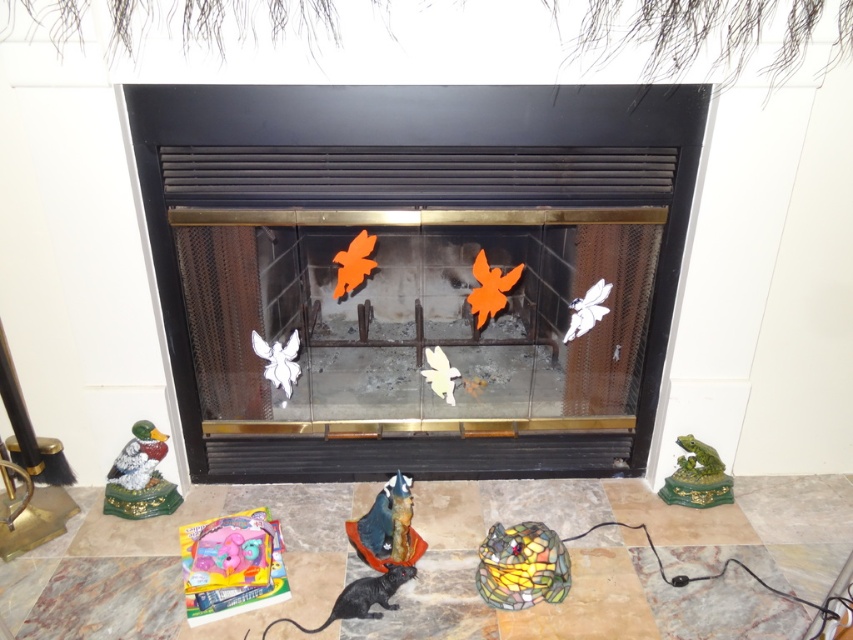
Is shiny metallic cat at center shorter than green glossy frog at lower right?

Incorrect, shiny metallic cat at center's height does not fall short of green glossy frog at lower right's.

Who is more forward, [389,486] or [683,486]?

Point [389,486] is in front.

Image resolution: width=853 pixels, height=640 pixels. In order to click on shiny metallic cat at center in this screenshot , I will do `click(387, 528)`.

Who is more forward, (128, 472) or (698, 474)?

Point (128, 472) is in front.

Does shiny green and gold duck at lower left have a larger size compared to green glossy frog at lower right?

Indeed, shiny green and gold duck at lower left has a larger size compared to green glossy frog at lower right.

Which is behind, point (148, 435) or point (708, 476)?

Positioned behind is point (708, 476).

Identify the location of shiny green and gold duck at lower left. (140, 476).

Can you confirm if shiny green and gold duck at lower left is shorter than white matte butterfly at center?

No.

Where is `shiny green and gold duck at lower left`? The image size is (853, 640). shiny green and gold duck at lower left is located at coordinates (140, 476).